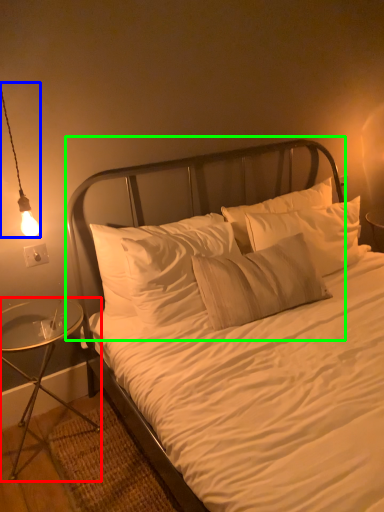
Question: Based on their relative distances, which object is nearer to nightstand (highlighted by a red box)? Choose from lamp (highlighted by a blue box) and headboard (highlighted by a green box).

Choices:
 (A) lamp
 (B) headboard

Answer: (B)